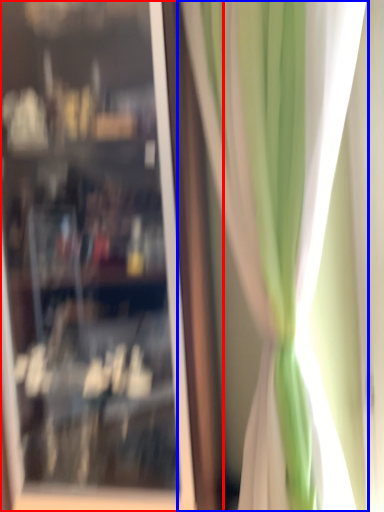
Question: Which point is closer to the camera, shop window (highlighted by a red box) or curtain (highlighted by a blue box)?

Choices:
 (A) shop window
 (B) curtain

Answer: (B)